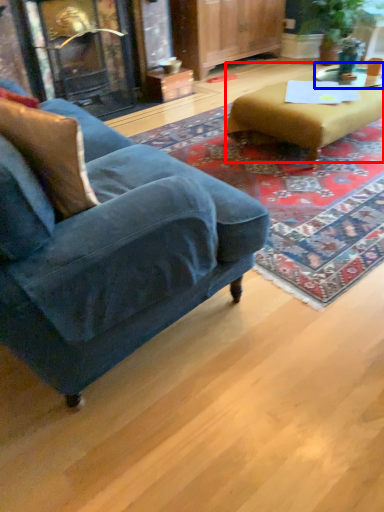
Question: Which object is closer to the camera taking this photo, table (highlighted by a red box) or side table (highlighted by a blue box)?

Choices:
 (A) table
 (B) side table

Answer: (A)